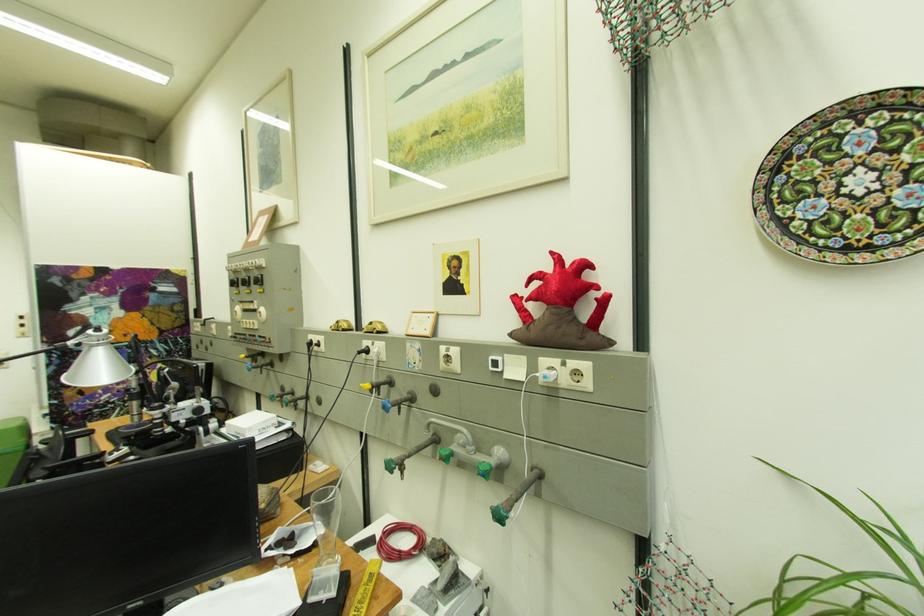
The height and width of the screenshot is (616, 924). What do you see at coordinates (485, 468) in the screenshot?
I see `the blue valve handle` at bounding box center [485, 468].